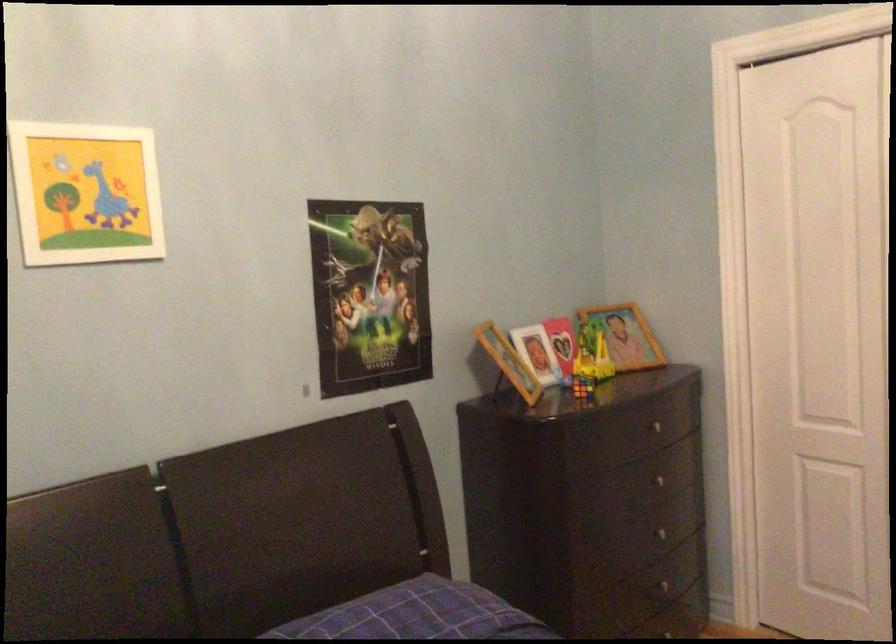
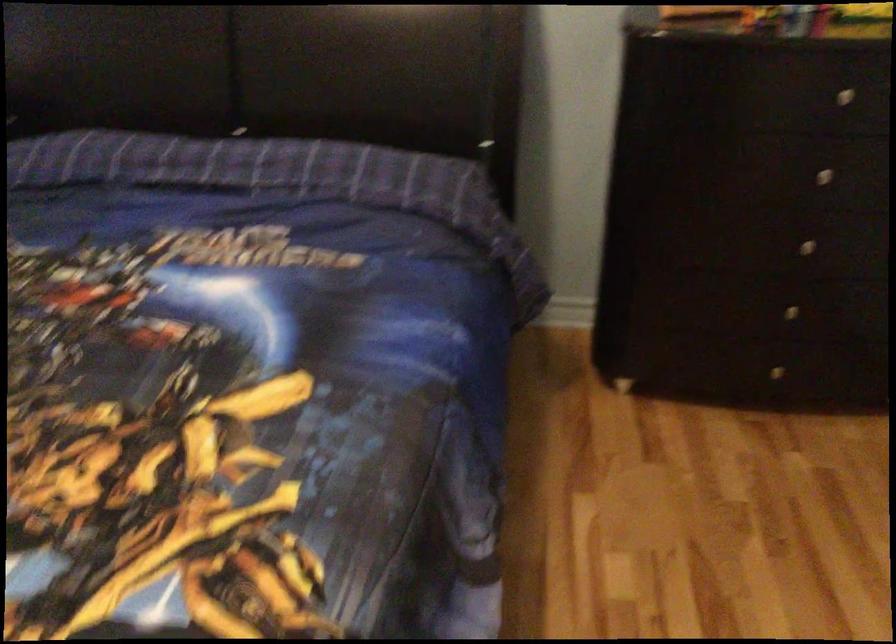
In the second image, find the point that corresponds to [665,478] in the first image.

(833, 169)